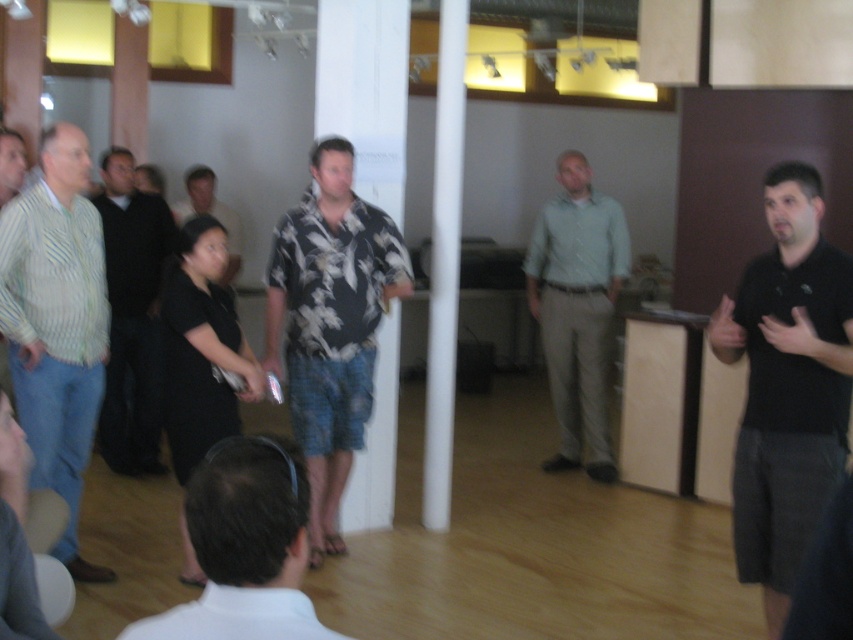
Is floral print shirt at center to the left of striped cotton shirt at left from the viewer's perspective?

Incorrect, floral print shirt at center is not on the left side of striped cotton shirt at left.

Is floral print shirt at center positioned in front of striped cotton shirt at left?

No, it is behind striped cotton shirt at left.

The image size is (853, 640). I want to click on floral print shirt at center, so point(329,323).

The height and width of the screenshot is (640, 853). I want to click on floral print shirt at center, so click(329, 323).

Does white matte shirt at lower center lie behind black floral shirt at center?

No, it is in front of black floral shirt at center.

Can you confirm if white matte shirt at lower center is positioned above black floral shirt at center?

Incorrect, white matte shirt at lower center is not positioned above black floral shirt at center.

Which is in front, point (252, 435) or point (189, 216)?

Point (252, 435)

The width and height of the screenshot is (853, 640). Identify the location of white matte shirt at lower center. (244, 547).

Which is more to the right, black matte shirt at right or black floral shirt at center?

black matte shirt at right is more to the right.

Does black matte shirt at right have a lesser height compared to black floral shirt at center?

No, black matte shirt at right is not shorter than black floral shirt at center.

Is point (764, 356) in front of point (212, 188)?

Yes, it is in front of point (212, 188).

Image resolution: width=853 pixels, height=640 pixels. Find the location of `black matte shirt at right`. black matte shirt at right is located at coordinates (787, 385).